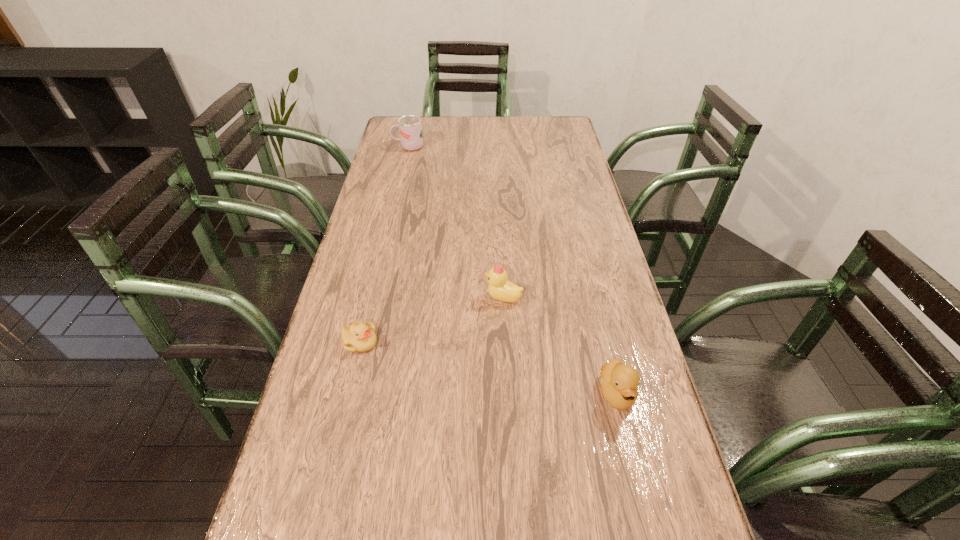
What are the coordinates of `the farthest object` in the screenshot? It's located at (410, 127).

Where is `the tallest object`? Image resolution: width=960 pixels, height=540 pixels. the tallest object is located at coordinates (410, 127).

At what (x,y) coordinates should I click in order to perform the action: click on the farthest duckling. Please return your answer as a coordinate pair (x, y). The height and width of the screenshot is (540, 960). Looking at the image, I should click on (499, 288).

Image resolution: width=960 pixels, height=540 pixels. What are the coordinates of `the second object from right to left` in the screenshot? It's located at (499, 288).

The height and width of the screenshot is (540, 960). In order to click on the rightmost duckling in this screenshot , I will do `click(619, 382)`.

Image resolution: width=960 pixels, height=540 pixels. Identify the location of the rightmost object. (619, 382).

Where is `the second nearest duckling`? the second nearest duckling is located at coordinates (359, 337).

This screenshot has height=540, width=960. What are the coordinates of `the shortest duckling` in the screenshot? It's located at (359, 337).

I want to click on vacant space located on the front-facing side of the second object from right to left, so click(362, 298).

Locate an element on the screen. This screenshot has height=540, width=960. vacant space situated on the front-facing side of the second object from right to left is located at coordinates (449, 298).